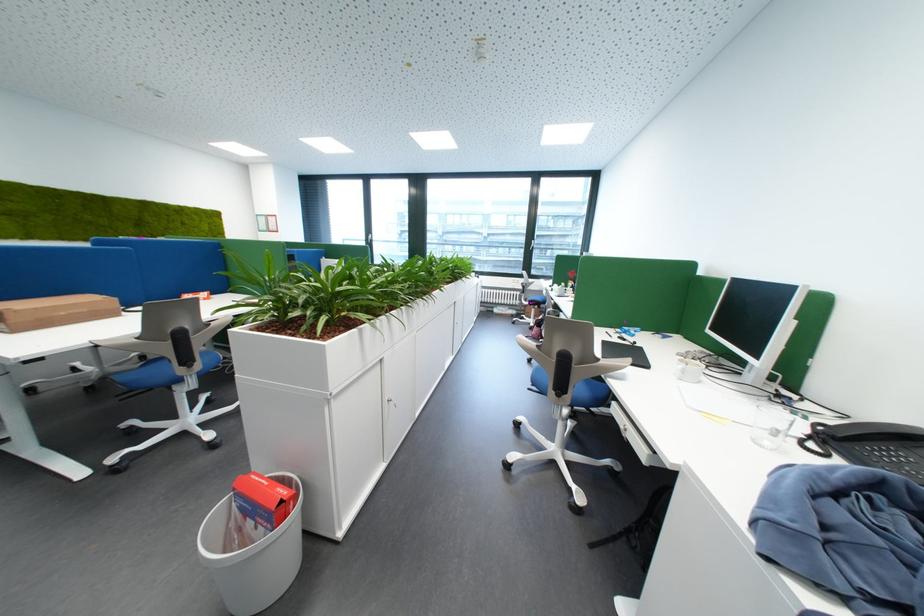
The width and height of the screenshot is (924, 616). Identify the location of dark window handle. (355, 233).